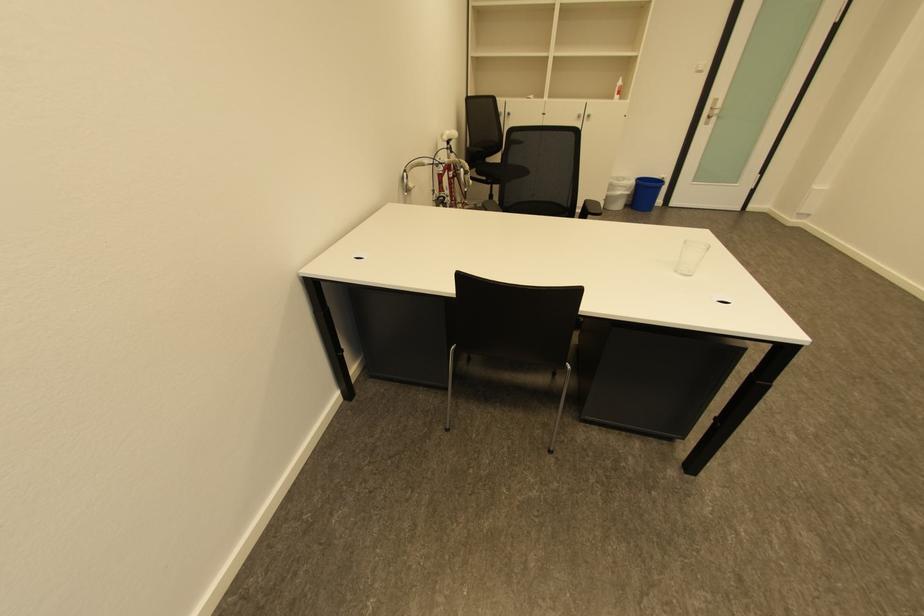
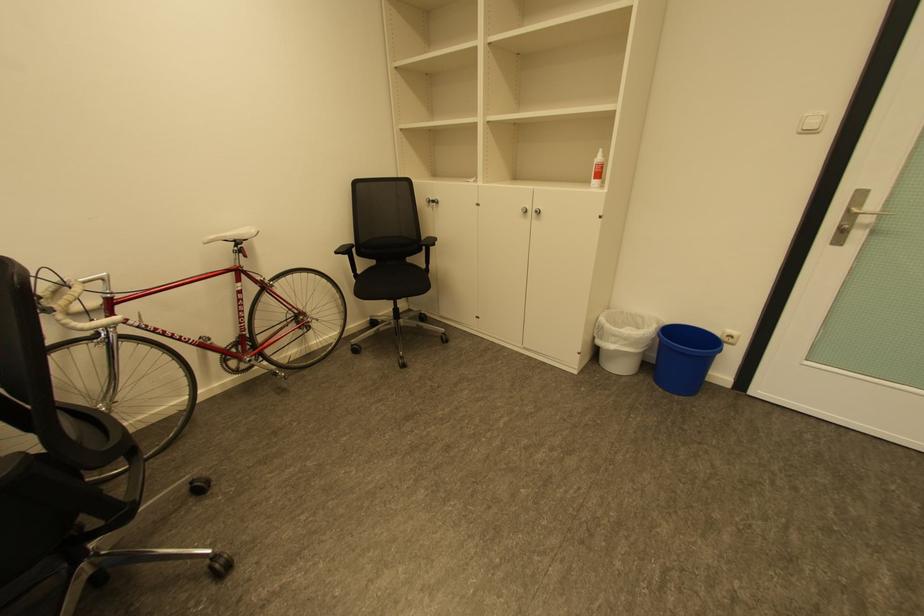
In the second image, find the point that corresponds to [619,98] in the first image.

(597, 184)